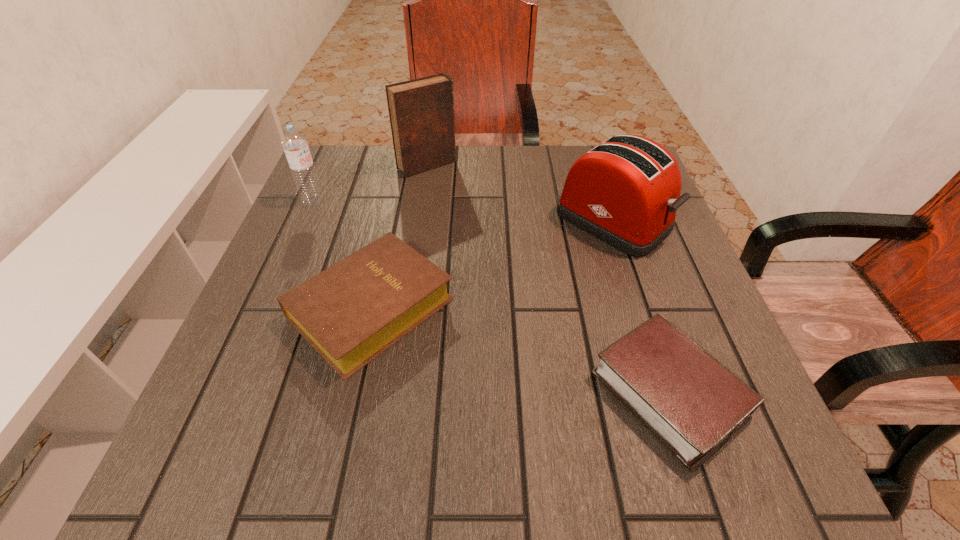
Identify the location of the farthest Bible. Image resolution: width=960 pixels, height=540 pixels. (421, 111).

The image size is (960, 540). Find the location of `the farthest object`. the farthest object is located at coordinates (421, 111).

I want to click on water bottle, so click(x=295, y=145).

This screenshot has width=960, height=540. I want to click on toaster, so click(626, 191).

Where is `the rightmost Bible`? The width and height of the screenshot is (960, 540). the rightmost Bible is located at coordinates (692, 403).

This screenshot has height=540, width=960. Find the location of `free space located on the front of the tallest Bible`. free space located on the front of the tallest Bible is located at coordinates (421, 205).

This screenshot has width=960, height=540. Identify the location of vacant space located 0.310m on the front of the water bottle. (266, 309).

At what (x,y) coordinates should I click in order to perform the action: click on free space located 0.170m on the left of the toaster. Please return your answer as a coordinate pair (x, y). The height and width of the screenshot is (540, 960). Looking at the image, I should click on (482, 221).

Locate an element on the screen. The height and width of the screenshot is (540, 960). vacant region located on the back of the rightmost Bible is located at coordinates (620, 245).

The width and height of the screenshot is (960, 540). I want to click on Bible that is at the far edge, so click(x=421, y=111).